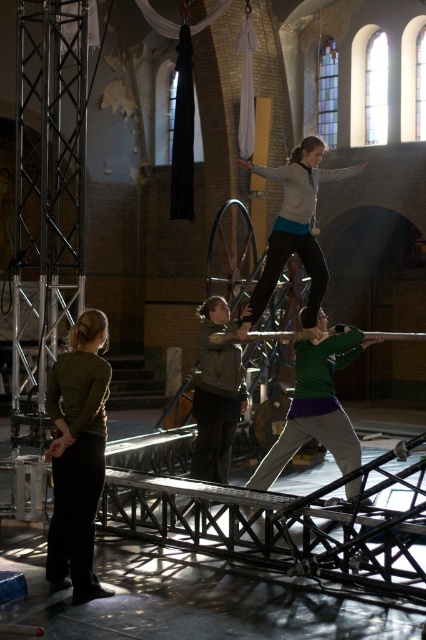
Question: Which point is closer to the camera?

Choices:
 (A) (336, 364)
 (B) (78, 508)

Answer: (B)

Question: Does matte olive green sweater at lower left have a larger size compared to gray sweater at center?

Choices:
 (A) no
 (B) yes

Answer: (A)

Question: Estimate the real-world distances between objects in this image. Which object is closer to the green matte shirt at center?

Choices:
 (A) dark brown leather jacket at center
 (B) gray sweater at center

Answer: (A)

Question: Does green matte shirt at center appear on the left side of dark brown leather jacket at center?

Choices:
 (A) no
 (B) yes

Answer: (A)

Question: Is matte olive green sweater at lower left smaller than gray sweater at center?

Choices:
 (A) no
 (B) yes

Answer: (B)

Question: Which object is farther from the camera taking this photo?

Choices:
 (A) green matte shirt at center
 (B) gray sweater at center
 (C) matte olive green sweater at lower left
 (D) dark brown leather jacket at center

Answer: (D)